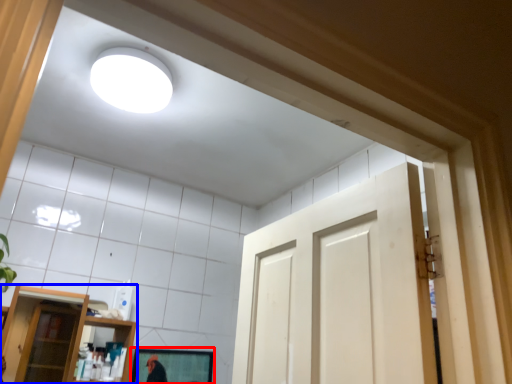
Question: Which object is closer to the camera taking this photo, mirror (highlighted by a red box) or shelf (highlighted by a blue box)?

Choices:
 (A) mirror
 (B) shelf

Answer: (B)